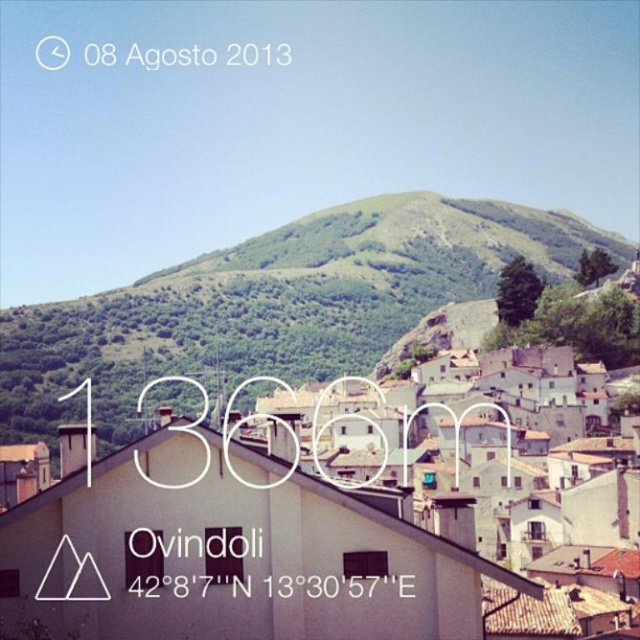
You are standing in Ovindoli and want to take a photo of the white matte building at center and the green grassy hill at upper center. If you want to frame both in your camera, which direction should you move to ensure both are visible in the shot?

You should move to the right so that the white matte building at center, which is to the left of the green grassy hill at upper center, comes into view alongside the hill.

You are standing in Ovindoli and want to determine which of the two points, point (365,627) or point (445,236), is nearer to you. Based on the scene, can you identify the closer point?

Point (365,627) is closer to the viewer than point (445,236).